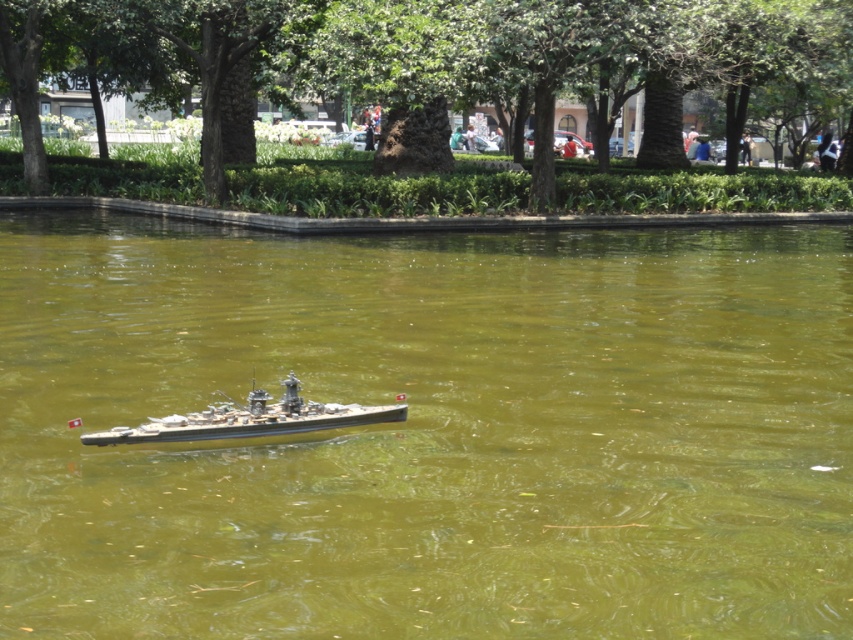
Does green murky water at center lie in front of metallic gray ship at center?

Yes, green murky water at center is in front of metallic gray ship at center.

The height and width of the screenshot is (640, 853). What do you see at coordinates (428, 433) in the screenshot? I see `green murky water at center` at bounding box center [428, 433].

The height and width of the screenshot is (640, 853). Identify the location of green murky water at center. (428, 433).